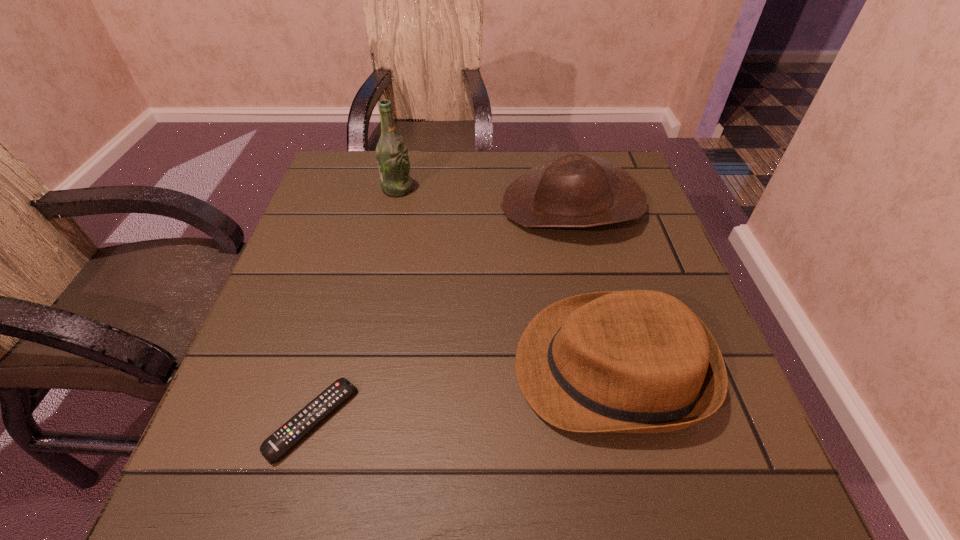
Image resolution: width=960 pixels, height=540 pixels. In order to click on beer bottle that is at the far edge in this screenshot , I will do `click(392, 157)`.

You are a GUI agent. You are given a task and a screenshot of the screen. Output one action in this format:
    pyautogui.click(x=<x>, y=<y>)
    Task: Click on the cowboy hat situated at the far edge
    This screenshot has width=960, height=540.
    Given the screenshot: What is the action you would take?
    pyautogui.click(x=573, y=191)

The image size is (960, 540). Find the location of `object present at the near edge`. object present at the near edge is located at coordinates (277, 444).

At what (x,y) coordinates should I click in order to perform the action: click on beer bottle that is at the left edge. Please return your answer as a coordinate pair (x, y). This screenshot has height=540, width=960. Looking at the image, I should click on (392, 157).

Locate an element on the screen. remote control located at the left edge is located at coordinates (277, 444).

Identify the location of cowboy hat located in the right edge section of the desktop. (573, 191).

The width and height of the screenshot is (960, 540). Find the location of `fedora located at the right edge`. fedora located at the right edge is located at coordinates (636, 361).

Find the location of a particular element. This screenshot has width=960, height=540. object situated at the far left corner is located at coordinates (392, 157).

I want to click on object located in the near left corner section of the desktop, so click(x=277, y=444).

At what (x,y) coordinates should I click in order to perform the action: click on object that is at the far right corner. Please return your answer as a coordinate pair (x, y). The height and width of the screenshot is (540, 960). Looking at the image, I should click on (573, 191).